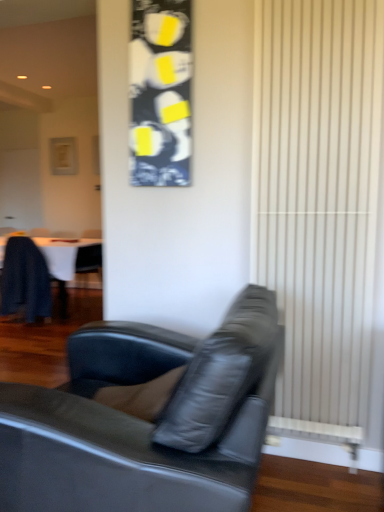
Identify the location of white textured radiator at right. The height and width of the screenshot is (512, 384). (319, 202).

Considering the positions of points (336, 426) and (58, 245), is point (336, 426) closer to camera compared to point (58, 245)?

Yes, it is.

Does white textured radiator at right appear on the right side of dark wood table at left?

Correct, you'll find white textured radiator at right to the right of dark wood table at left.

Is white textured radiator at right taller than dark wood table at left?

Yes, white textured radiator at right is taller than dark wood table at left.

Is dark wood table at left aimed at dark blue leather chair at left?

Yes, dark wood table at left is aimed at dark blue leather chair at left.

Is dark wood table at left positioned beyond the bounds of dark blue leather chair at left?

Yes.

Is dark wood table at left not near dark blue leather chair at left?

dark wood table at left is actually quite close to dark blue leather chair at left.

Image resolution: width=384 pixels, height=512 pixels. In order to click on studio couch lying in front of the dark blue leather chair at left in this screenshot , I will do `click(146, 418)`.

Based on their sizes in the image, would you say dark blue leather chair at left is bigger or smaller than black leather couch at center?

Clearly, dark blue leather chair at left is smaller in size than black leather couch at center.

Considering the positions of objects dark blue leather chair at left and black leather couch at center in the image provided, who is in front, dark blue leather chair at left or black leather couch at center?

black leather couch at center is in front.

From a real-world perspective, relative to white textured radiator at right, is dark blue leather chair at left vertically above or below?

From a real-world perspective, dark blue leather chair at left is physically below white textured radiator at right.

I want to click on chair lying behind the white textured radiator at right, so click(x=25, y=280).

Considering the positions of objects dark blue leather chair at left and white textured radiator at right in the image provided, who is more to the right, dark blue leather chair at left or white textured radiator at right?

Positioned to the right is white textured radiator at right.

Between dark blue leather chair at left and white textured radiator at right, which one has more height?

With more height is white textured radiator at right.

Where is `curtain behind the black leather couch at center`? Image resolution: width=384 pixels, height=512 pixels. curtain behind the black leather couch at center is located at coordinates (319, 202).

Is black leather couch at center at the right side of white textured radiator at right?

No, black leather couch at center is not to the right of white textured radiator at right.

Is black leather couch at center inside the boundaries of white textured radiator at right, or outside?

black leather couch at center is not inside white textured radiator at right, it's outside.

Considering the relative sizes of black leather couch at center and white textured radiator at right in the image provided, is black leather couch at center wider than white textured radiator at right?

Yes.

From the image's perspective, which one is positioned lower, dark blue leather chair at left or dark wood table at left?

dark blue leather chair at left, from the image's perspective.

From a real-world perspective, who is located lower, dark blue leather chair at left or dark wood table at left?

From a 3D spatial view, dark wood table at left is below.

Considering the positions of points (38, 265) and (52, 259), is point (38, 265) farther from camera compared to point (52, 259)?

No, (38, 265) is in front of (52, 259).

Can you confirm if white textured radiator at right is positioned to the right of dark blue leather chair at left?

Yes.

Considering the relative sizes of white textured radiator at right and dark blue leather chair at left in the image provided, is white textured radiator at right taller than dark blue leather chair at left?

Yes, white textured radiator at right is taller than dark blue leather chair at left.

How many degrees apart are the facing directions of white textured radiator at right and dark blue leather chair at left?

There is a 178-degree angle between the facing directions of white textured radiator at right and dark blue leather chair at left.

Is white textured radiator at right inside the boundaries of dark blue leather chair at left, or outside?

white textured radiator at right is spatially situated outside dark blue leather chair at left.

The image size is (384, 512). I want to click on curtain that appears on the right of dark wood table at left, so click(319, 202).

Where is `table that appears on the left of dark blue leather chair at left`? table that appears on the left of dark blue leather chair at left is located at coordinates (43, 272).

Looking at the image, which one is located closer to dark blue leather chair at left, black leather couch at center or white textured radiator at right?

Among the two, black leather couch at center is located nearer to dark blue leather chair at left.

Based on their spatial positions, is dark wood table at left or white textured radiator at right closer to black leather couch at center?

Among the two, white textured radiator at right is located nearer to black leather couch at center.

When comparing their distances from black leather couch at center, does white textured radiator at right or dark blue leather chair at left seem further?

dark blue leather chair at left is further to black leather couch at center.

Estimate the real-world distances between objects in this image. Which object is closer to white textured radiator at right, dark wood table at left or dark blue leather chair at left?

dark wood table at left lies closer to white textured radiator at right than the other object.

From the image, which object appears to be nearer to dark blue leather chair at left, dark wood table at left or white textured radiator at right?

Based on the image, dark wood table at left appears to be nearer to dark blue leather chair at left.

When comparing their distances from black leather couch at center, does white textured radiator at right or dark wood table at left seem closer?

white textured radiator at right is closer to black leather couch at center.

Based on their spatial positions, is dark blue leather chair at left or dark wood table at left closer to black leather couch at center?

Based on the image, dark wood table at left appears to be nearer to black leather couch at center.

Looking at the image, which one is located further to dark blue leather chair at left, dark wood table at left or black leather couch at center?

black leather couch at center is further to dark blue leather chair at left.

The image size is (384, 512). Identify the location of curtain between black leather couch at center and dark blue leather chair at left in the front-back direction. (319, 202).

This screenshot has height=512, width=384. Identify the location of chair located between black leather couch at center and dark wood table at left in the depth direction. (25, 280).

I want to click on curtain positioned between black leather couch at center and dark wood table at left from near to far, so 319,202.

What are the coordinates of `chair positioned between white textured radiator at right and dark wood table at left from near to far` in the screenshot? It's located at (25, 280).